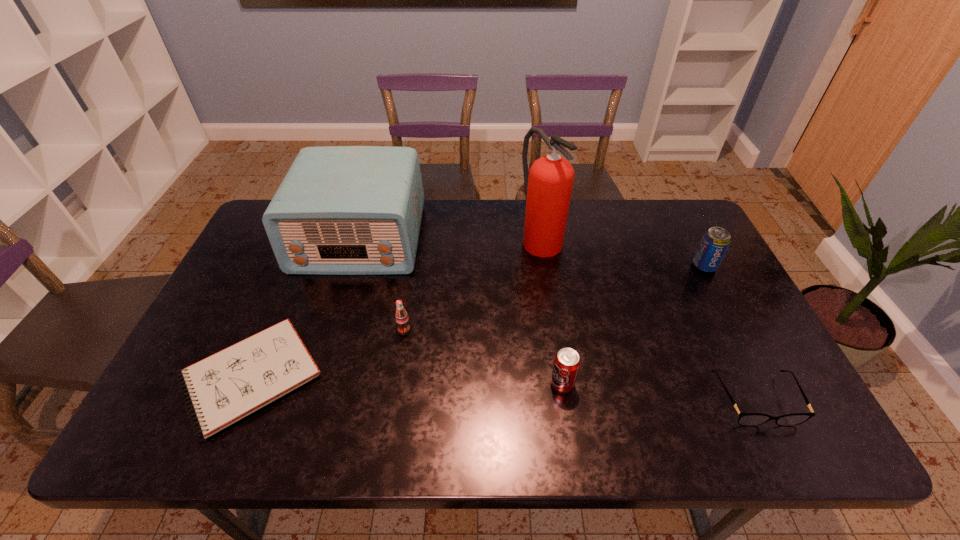
Locate an element on the screen. vacant space in between the nearest soda and the fire extinguisher is located at coordinates (x=551, y=310).

This screenshot has height=540, width=960. I want to click on vacant space that is in between the fire extinguisher and the radio receiver, so click(450, 238).

This screenshot has width=960, height=540. In order to click on vacant area that lies between the second nearest soda and the nearest soda in this screenshot , I will do tap(483, 357).

Find the location of a particular element. vacant space in between the notepad and the farthest soda is located at coordinates click(477, 322).

Where is `vacant space in between the second nearest soda and the sixth shortest object`? The image size is (960, 540). vacant space in between the second nearest soda and the sixth shortest object is located at coordinates (382, 284).

What are the coordinates of `free area in between the notepad and the leftmost soda` in the screenshot? It's located at (327, 354).

Identify the location of vacant space that's between the second nearest soda and the farthest soda. (554, 298).

Where is `vacant region between the rightmost soda and the shortest object`? The width and height of the screenshot is (960, 540). vacant region between the rightmost soda and the shortest object is located at coordinates (477, 322).

The image size is (960, 540). I want to click on blank region between the shortest object and the farthest soda, so click(x=477, y=322).

The height and width of the screenshot is (540, 960). I want to click on object that is the fifth closest to the sixth tallest object, so click(340, 210).